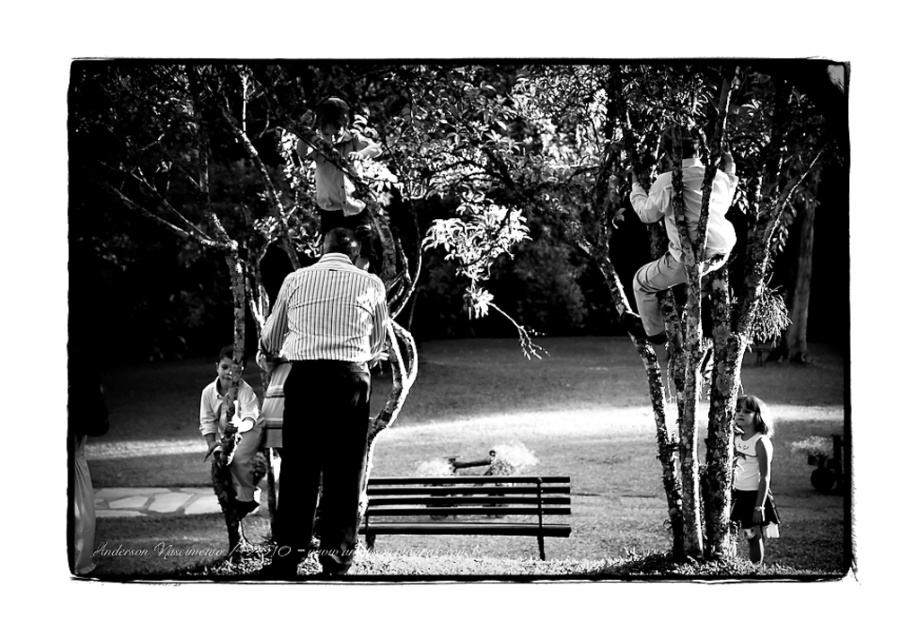
You are a photographer trying to capture a candid shot of the smooth skin child at lower left and the white matte dress at lower right. Since you want both subjects to be in focus, which one should you focus on first to ensure the other is also sharp?

You should focus on the smooth skin child at lower left first because it is closer to the camera than the white matte dress at lower right. By focusing on the closer subject, the farther one will still be in focus due to the depth of field.

You are a photographer standing at the edge of the park. You want to take a photo that includes both the wooden bench at center and the smooth white shirt at upper center. Given their distance apart, will you need to zoom in or zoom out to fit both into the frame?

The wooden bench at center and smooth white shirt at upper center are 14.42 meters apart from each other. To capture both in the same frame, you would need to zoom out to widen the field of view so that both objects can be included in the photograph.